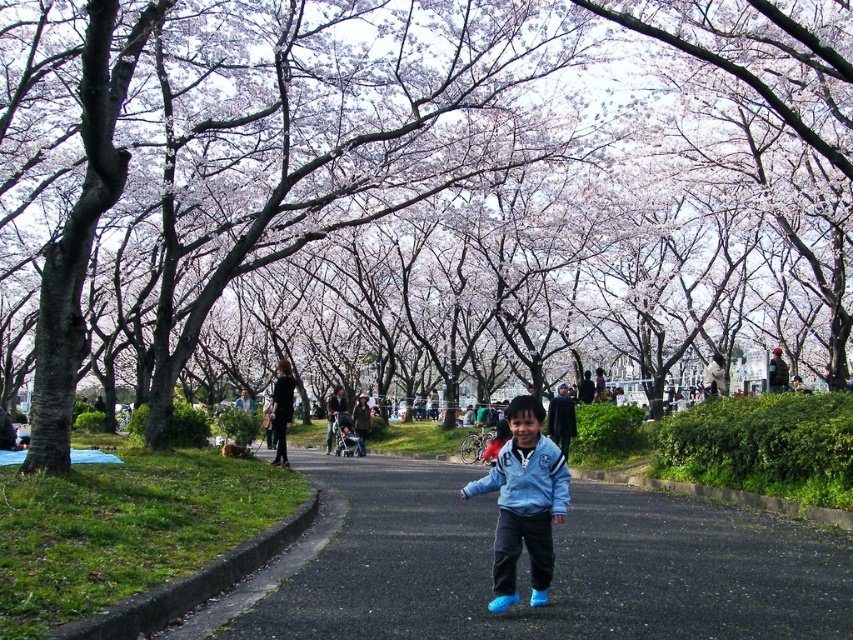
Does smooth bark tree at center have a greater height compared to blue matte jacket at center?

Yes, smooth bark tree at center is taller than blue matte jacket at center.

Does smooth bark tree at center appear on the left side of blue matte jacket at center?

Incorrect, smooth bark tree at center is not on the left side of blue matte jacket at center.

Is point (679, 237) positioned behind point (511, 486)?

Yes, it is behind point (511, 486).

The width and height of the screenshot is (853, 640). I want to click on smooth bark tree at center, so click(426, 189).

Does black asphalt road at center have a larger size compared to blue fabric jacket at center?

Correct, black asphalt road at center is larger in size than blue fabric jacket at center.

Between black asphalt road at center and blue fabric jacket at center, which one is positioned lower?

black asphalt road at center is below.

Is point (575, 481) positioned before point (543, 532)?

That is False.

The width and height of the screenshot is (853, 640). I want to click on black asphalt road at center, so click(x=527, y=566).

Between blue fabric jacket at center and blue matte jacket at center, which one appears on the left side from the viewer's perspective?

From the viewer's perspective, blue matte jacket at center appears more on the left side.

Can you confirm if blue fabric jacket at center is bigger than blue matte jacket at center?

Correct, blue fabric jacket at center is larger in size than blue matte jacket at center.

Where is `blue fabric jacket at center`? This screenshot has height=640, width=853. blue fabric jacket at center is located at coordinates (524, 502).